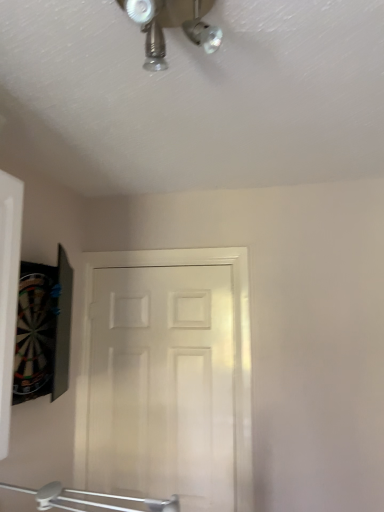
Question: Is metallic chrome mechanical fan at upper center a part of white matte door at center?

Choices:
 (A) no
 (B) yes

Answer: (A)

Question: From a real-world perspective, does white matte door at center stand above metallic chrome mechanical fan at upper center?

Choices:
 (A) no
 (B) yes

Answer: (A)

Question: Is white matte door at center turned away from metallic chrome mechanical fan at upper center?

Choices:
 (A) no
 (B) yes

Answer: (A)

Question: From the image's perspective, would you say white matte door at center is shown under metallic chrome mechanical fan at upper center?

Choices:
 (A) no
 (B) yes

Answer: (B)

Question: Is white matte door at center positioned beyond the bounds of metallic chrome mechanical fan at upper center?

Choices:
 (A) yes
 (B) no

Answer: (A)

Question: From the image's perspective, does white matte door at center appear higher than metallic chrome mechanical fan at upper center?

Choices:
 (A) yes
 (B) no

Answer: (B)

Question: From a real-world perspective, is metallic chrome mechanical fan at upper center on top of white matte door at center?

Choices:
 (A) no
 (B) yes

Answer: (B)

Question: Is metallic chrome mechanical fan at upper center positioned before white matte door at center?

Choices:
 (A) no
 (B) yes

Answer: (B)

Question: Does metallic chrome mechanical fan at upper center have a smaller size compared to white matte door at center?

Choices:
 (A) no
 (B) yes

Answer: (B)

Question: Can you confirm if metallic chrome mechanical fan at upper center is thinner than white matte door at center?

Choices:
 (A) no
 (B) yes

Answer: (A)

Question: Is metallic chrome mechanical fan at upper center not within white matte door at center?

Choices:
 (A) yes
 (B) no

Answer: (A)

Question: Can you see metallic chrome mechanical fan at upper center touching white matte door at center?

Choices:
 (A) no
 (B) yes

Answer: (A)

Question: Is metallic chrome mechanical fan at upper center taller or shorter than white matte door at center?

Choices:
 (A) tall
 (B) short

Answer: (B)